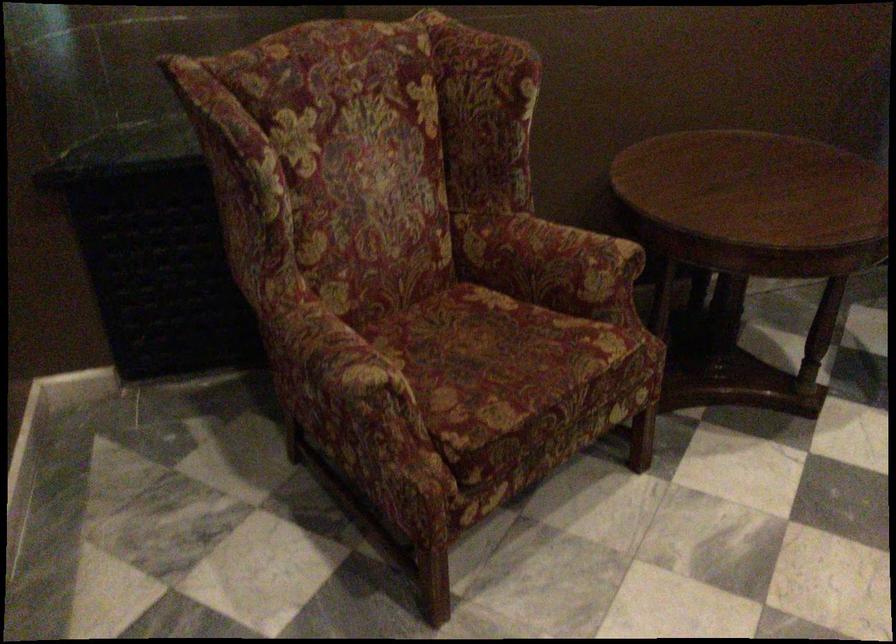
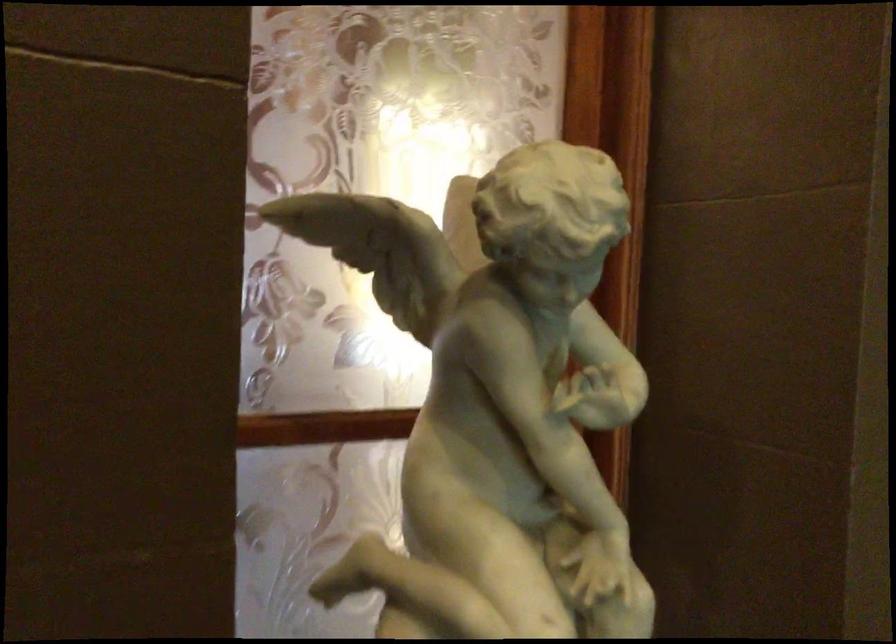
Question: The camera is either moving clockwise (left) or counter-clockwise (right) around the object. The first image is from the beginning of the video and the second image is from the end. Is the camera moving left or right when shooting the video?

Choices:
 (A) Left
 (B) Right

Answer: (B)